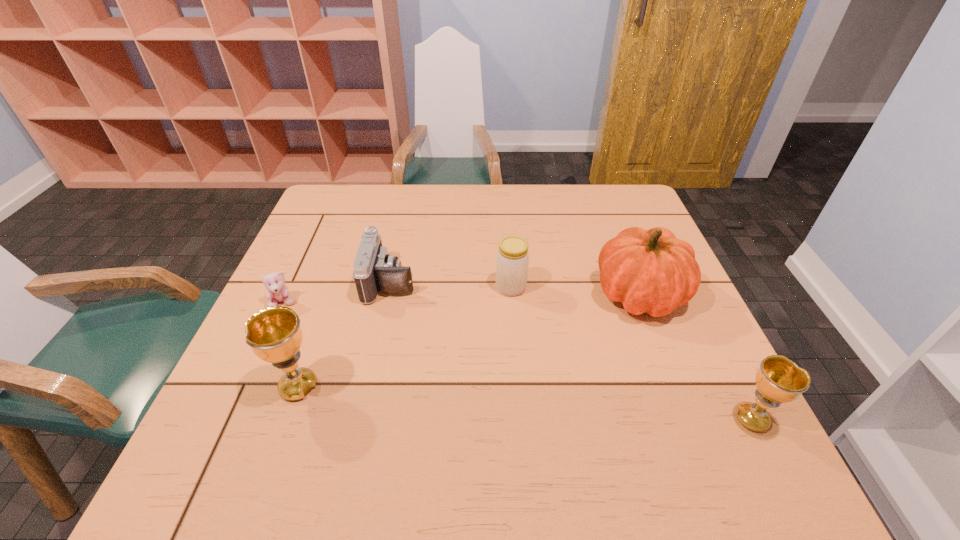
Please point a space for a new chalice to maintain equal intervals. Please provide its 2D coordinates. Your answer should be formatted as a tuple, i.e. [(x, y)], where the tuple contains the x and y coordinates of a point satisfying the conditions above.

[(517, 402)]